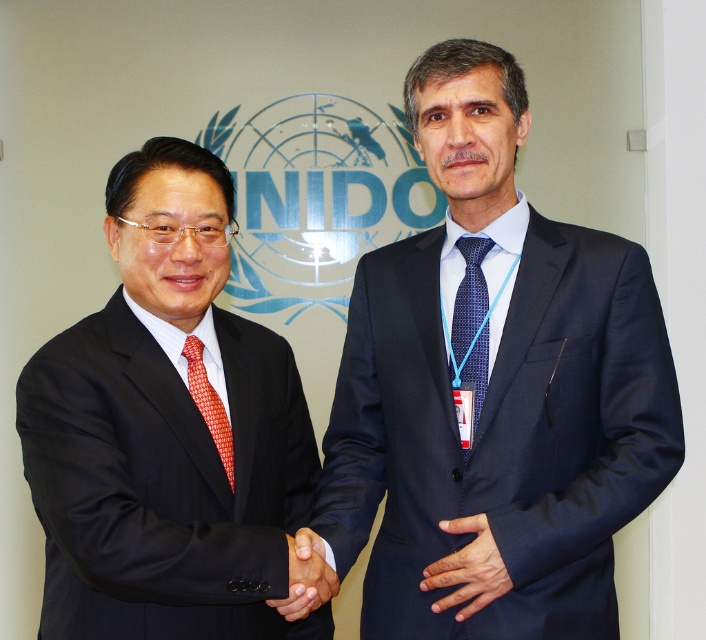
Can you confirm if blue dotted fabric tie at center is taller than black glossy hand at center?

Yes, blue dotted fabric tie at center is taller than black glossy hand at center.

The width and height of the screenshot is (706, 640). I want to click on blue dotted fabric tie at center, so click(x=472, y=321).

Does matte black suit at left come in front of dark blue fabric hand at center?

Yes, matte black suit at left is closer to the viewer.

Image resolution: width=706 pixels, height=640 pixels. I want to click on matte black suit at left, so click(x=167, y=429).

Does point (496, 595) lie behind point (333, 589)?

That is False.

Which is above, dark blue fabric hand at center or black glossy hand at center?

black glossy hand at center is higher up.

Which is behind, point (462, 609) or point (321, 580)?

The point (462, 609) is behind.

Where is `dark blue fabric hand at center`? Image resolution: width=706 pixels, height=640 pixels. dark blue fabric hand at center is located at coordinates (467, 568).